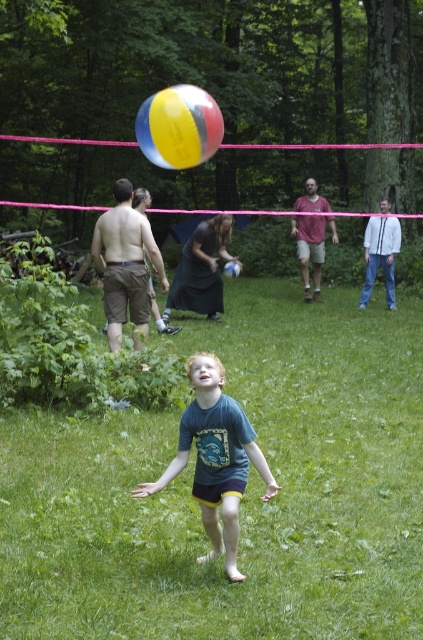
Between brown cotton shorts at left and blue t-shirt at center, which one has more height?

With more height is blue t-shirt at center.

Is point (132, 317) closer to camera compared to point (384, 241)?

Yes, it is.

Image resolution: width=423 pixels, height=640 pixels. In order to click on brown cotton shorts at left in this screenshot , I will do `click(126, 266)`.

Where is `green grass at center`? green grass at center is located at coordinates 246,490.

From the picture: Between green grass at center and blue t-shirt at center, which one appears on the right side from the viewer's perspective?

blue t-shirt at center is more to the right.

Is point (249, 614) less distant than point (395, 224)?

Yes, point (249, 614) is closer to viewer.

In order to click on green grass at center in this screenshot , I will do `click(246, 490)`.

Does green grass at center appear under multicolored inflatable ball at upper center?

Yes, green grass at center is below multicolored inflatable ball at upper center.

Which is below, green grass at center or multicolored inflatable ball at upper center?

green grass at center is lower down.

Is point (58, 544) behind point (208, 140)?

No, it is in front of (208, 140).

Locate an element on the screen. Image resolution: width=423 pixels, height=640 pixels. green grass at center is located at coordinates (246, 490).